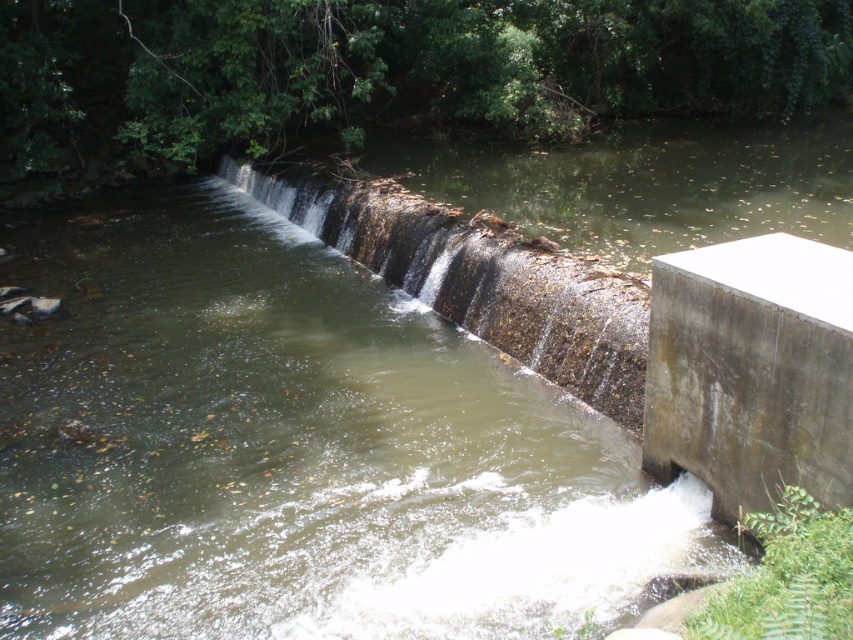
Question: Which point is closer to the camera?

Choices:
 (A) gray concrete wall at lower right
 (B) brown textured concrete waterfall at center

Answer: (A)

Question: From the image, what is the correct spatial relationship of gray concrete wall at lower right in relation to brown textured concrete waterfall at center?

Choices:
 (A) below
 (B) above

Answer: (A)

Question: In this image, where is gray concrete wall at lower right located relative to brown textured concrete waterfall at center?

Choices:
 (A) below
 (B) above

Answer: (A)

Question: Does gray concrete wall at lower right have a larger size compared to brown textured concrete waterfall at center?

Choices:
 (A) no
 (B) yes

Answer: (A)

Question: Which object is farther from the camera taking this photo?

Choices:
 (A) brown textured concrete waterfall at center
 (B) gray concrete wall at lower right

Answer: (A)